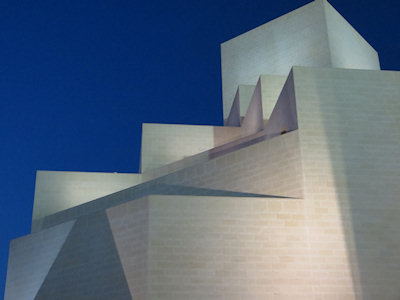
Identify the location of corner. The image size is (400, 300). pos(327,40).